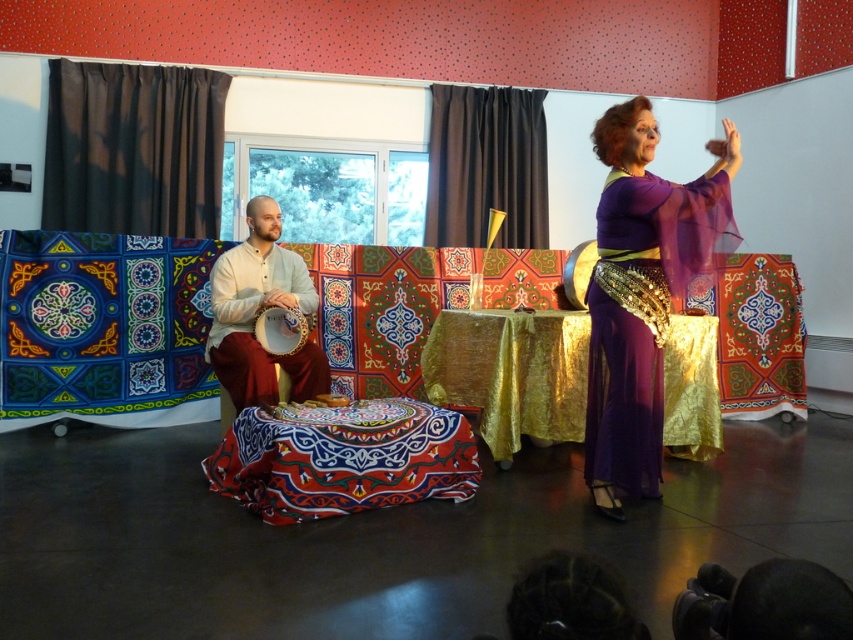
Between purple chiffon dress at center and embroidered fabric ottoman at center, which one has less height?

With less height is embroidered fabric ottoman at center.

What are the coordinates of `purple chiffon dress at center` in the screenshot? It's located at pyautogui.click(x=642, y=292).

Between point (631, 227) and point (303, 388), which one is positioned in front?

Point (631, 227) is in front.

Who is positioned more to the left, purple chiffon dress at center or light beige cotton drum at left?

light beige cotton drum at left is more to the left.

At what (x,y) coordinates should I click in order to perform the action: click on purple chiffon dress at center. Please return your answer as a coordinate pair (x, y). The height and width of the screenshot is (640, 853). Looking at the image, I should click on (642, 292).

Does purple chiffon dress at center appear on the left side of black curtain at left?

No, purple chiffon dress at center is not to the left of black curtain at left.

Can you confirm if purple chiffon dress at center is taller than black curtain at left?

Correct, purple chiffon dress at center is much taller as black curtain at left.

Is point (659, 278) in front of point (73, 122)?

That is True.

The image size is (853, 640). Find the location of `purple chiffon dress at center`. purple chiffon dress at center is located at coordinates (642, 292).